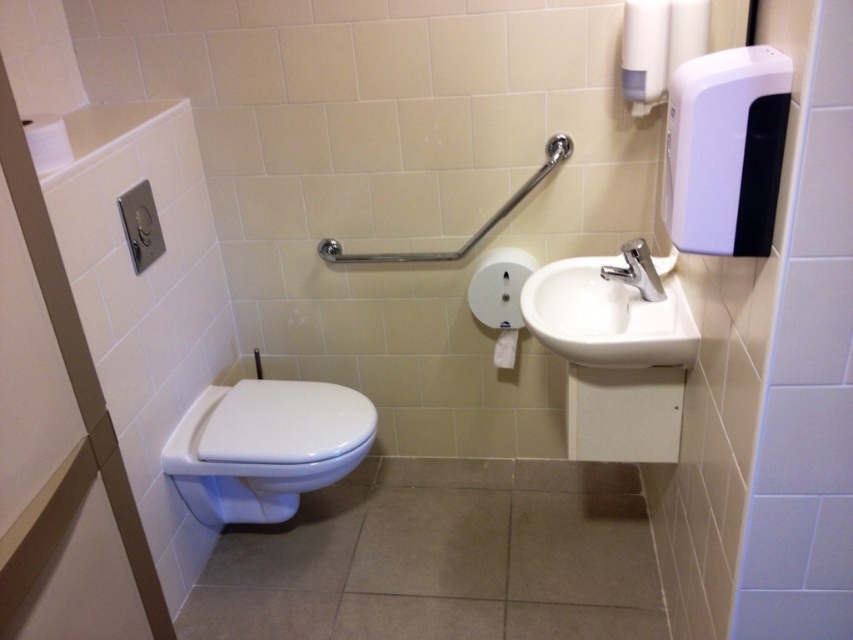
Based on the photo, you are standing in the bathroom and want to wash your hands. The white glossy sink at right and the silver metallic faucet at upper right are in your view. Which one should you approach first to turn on the water?

You should approach the white glossy sink at right first because it is closer to you than the silver metallic faucet at upper right, which is further away.

You are a maintenance worker checking the bathroom fixtures. You need to ensure that the white matte toilet paper at upper left is within reach for someone sitting on the toilet. The average sitting height is 45 cm. Is the toilet paper within reach?

The white matte toilet paper at upper left is 1.38 meters from the camera. Since the average sitting height is 45 cm, the toilet paper is 1.38 meters above the floor. This height is likely too high for someone sitting on the toilet to reach comfortably. Adjust the position of the toilet paper holder to a lower height for better accessibility.

You are trying to determine which object is larger between the white matte toilet paper at upper left and the silver metallic faucet at upper right. Based on the scene description, which one is bigger?

The white matte toilet paper at upper left is bigger than the silver metallic faucet at upper right according to the description.